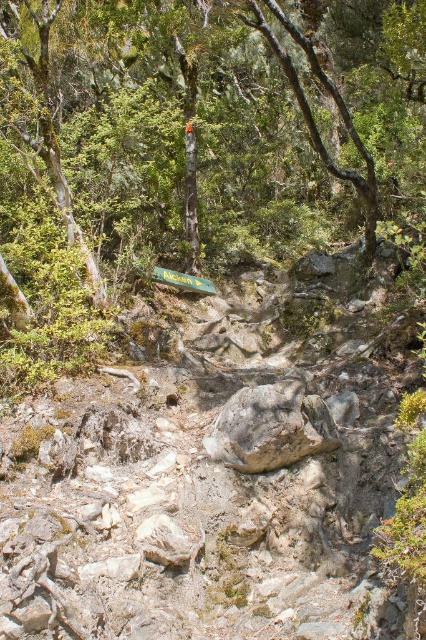
Does green leafy tree at center have a smaller size compared to gray rough rock at center?

Actually, green leafy tree at center might be larger than gray rough rock at center.

Which of these two, green leafy tree at center or gray rough rock at center, stands shorter?

gray rough rock at center is shorter.

Is point (17, 108) behind point (330, 429)?

That is True.

Find the location of a particular element. This screenshot has width=426, height=640. green leafy tree at center is located at coordinates (201, 140).